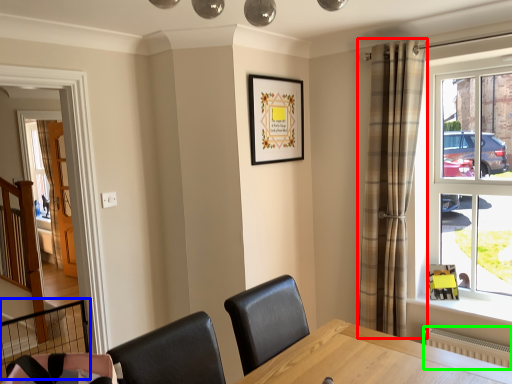
Question: Which object is the farthest from curtain (highlighted by a red box)? Choose among these: balustrade (highlighted by a blue box) or radiator (highlighted by a green box).

Choices:
 (A) balustrade
 (B) radiator

Answer: (A)